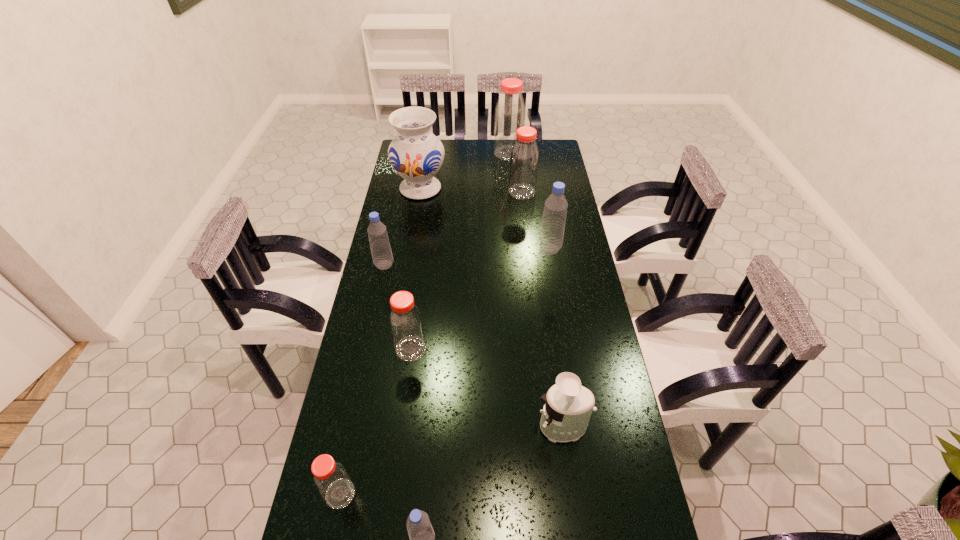
The image size is (960, 540). Find the location of `free space located 0.370m on the left of the third nearest object`. free space located 0.370m on the left of the third nearest object is located at coordinates (403, 427).

The width and height of the screenshot is (960, 540). I want to click on free space located on the back of the nearest red bottle, so click(x=368, y=362).

You are a GUI agent. You are given a task and a screenshot of the screen. Output one action in this format:
    pyautogui.click(x=<x>, y=<y>)
    Task: Click on the object located at the far edge
    The image size is (960, 540).
    Given the screenshot: What is the action you would take?
    pyautogui.click(x=510, y=113)

Where is `vase that is at the left edge`? The width and height of the screenshot is (960, 540). vase that is at the left edge is located at coordinates (416, 154).

The width and height of the screenshot is (960, 540). Find the location of `juicer positioned at the right edge`. juicer positioned at the right edge is located at coordinates (568, 406).

The image size is (960, 540). In the image, there is a desktop. In order to click on vacant space at the far edge in this screenshot , I will do `click(465, 150)`.

You are a GUI agent. You are given a task and a screenshot of the screen. Output one action in this format:
    pyautogui.click(x=<x>, y=<y>)
    Task: Click on the free region at the left edge
    This screenshot has height=540, width=960.
    Given the screenshot: What is the action you would take?
    pyautogui.click(x=396, y=233)

Identify the location of vacant space at the right edge of the desktop. (574, 262).

Find the location of a particular element. This screenshot has width=960, height=540. vacant space at the far right corner is located at coordinates (550, 151).

Where is `vacant area that lies between the vase and the second biggest red bottle`? The image size is (960, 540). vacant area that lies between the vase and the second biggest red bottle is located at coordinates (471, 190).